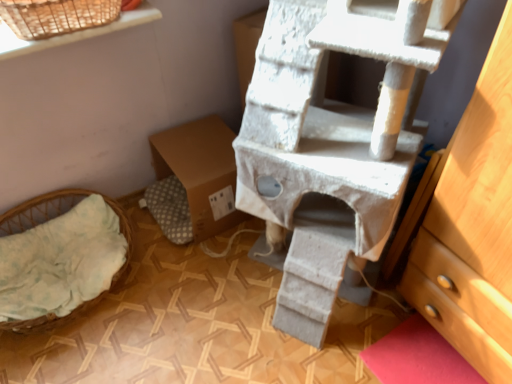
Identify the location of vacant area that is in front of brown cardboard box at center. (207, 276).